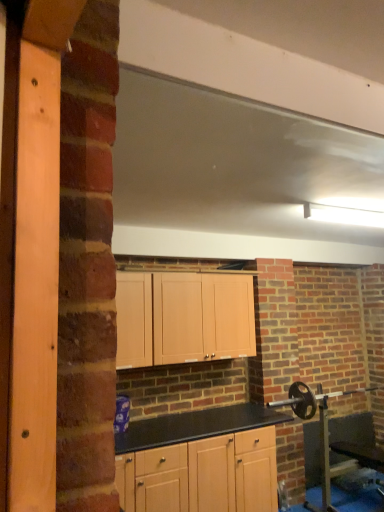
Image resolution: width=384 pixels, height=512 pixels. I want to click on free spot above matte wood fireplace at center (from a real-world perspective), so click(x=268, y=102).